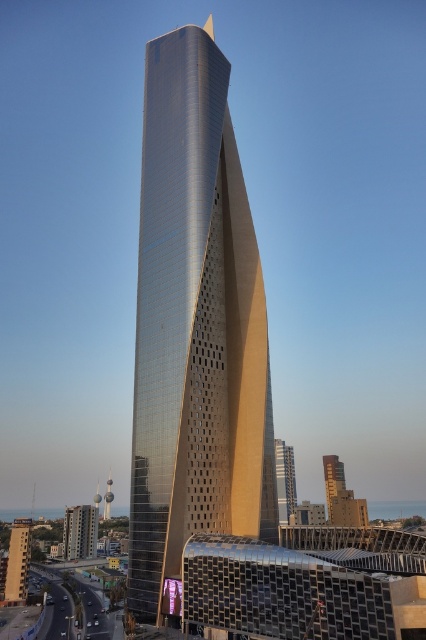
Is gold metallic building at center taller than gold textured tower at center?

No, gold metallic building at center is not taller than gold textured tower at center.

Who is more distant from viewer, (19,579) or (331,483)?

The point (331,483) is behind.

Between point (2, 570) and point (330, 461), which one is positioned in front?

Point (2, 570) is in front.

Where is `gold metallic building at center`? This screenshot has height=640, width=426. gold metallic building at center is located at coordinates (17, 563).

Find the location of a particular element. shiny glass skyscraper at center is located at coordinates (195, 324).

Can you confirm if shiny glass skyscraper at center is positioned to the right of gold textured glass tower at center?

No, shiny glass skyscraper at center is not to the right of gold textured glass tower at center.

Locate an element on the screen. Image resolution: width=426 pixels, height=640 pixels. shiny glass skyscraper at center is located at coordinates (195, 324).

Does gold metallic building at center have a lesser height compared to shiny metallic tower at center?

Yes.

Who is lower down, gold metallic building at center or shiny metallic tower at center?

Positioned lower is shiny metallic tower at center.

Who is more distant from viewer, (2, 576) or (112, 493)?

Point (112, 493)

Locate an element on the screen. The height and width of the screenshot is (640, 426). gold metallic building at center is located at coordinates (17, 563).